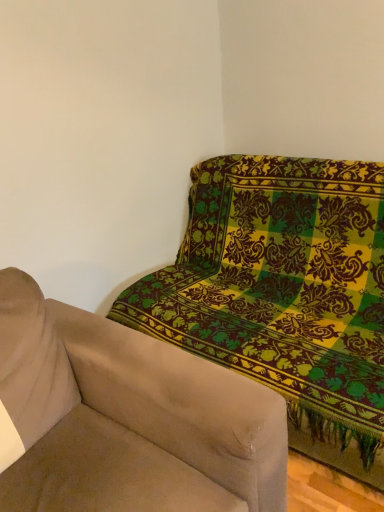
Question: Based on their sizes in the image, would you say beige fabric couch at upper right is bigger or smaller than green patterned fabric sofa at upper right?

Choices:
 (A) big
 (B) small

Answer: (B)

Question: Is point (228, 387) positioned closer to the camera than point (342, 271)?

Choices:
 (A) closer
 (B) farther

Answer: (A)

Question: From a real-world perspective, is beige fabric couch at upper right physically located above or below green patterned fabric sofa at upper right?

Choices:
 (A) below
 (B) above

Answer: (B)

Question: In the image, is green patterned fabric sofa at upper right on the left side or the right side of beige fabric couch at upper right?

Choices:
 (A) left
 (B) right

Answer: (B)

Question: Is green patterned fabric sofa at upper right inside or outside of beige fabric couch at upper right?

Choices:
 (A) outside
 (B) inside

Answer: (A)

Question: From the image's perspective, relative to beige fabric couch at upper right, is green patterned fabric sofa at upper right above or below?

Choices:
 (A) above
 (B) below

Answer: (A)

Question: Is green patterned fabric sofa at upper right taller or shorter than beige fabric couch at upper right?

Choices:
 (A) tall
 (B) short

Answer: (A)